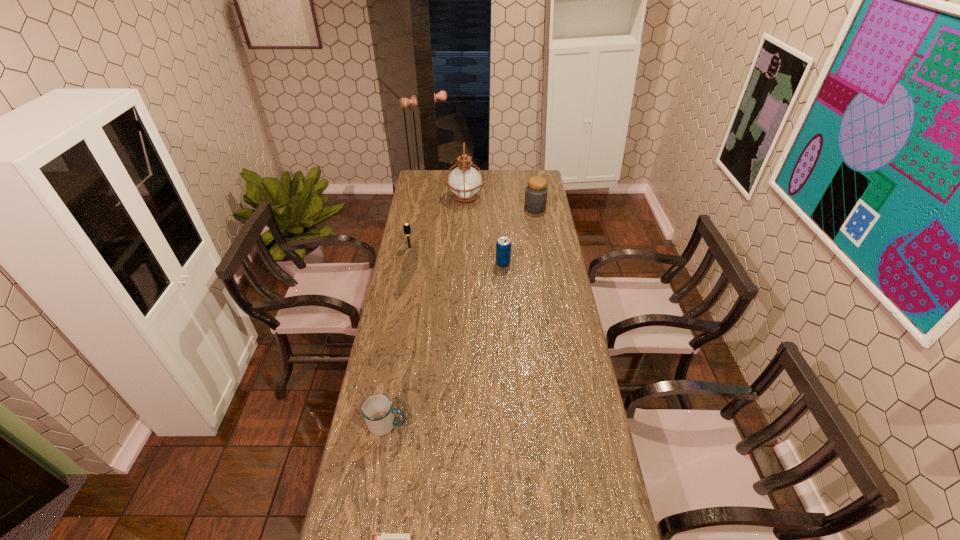
Locate an element on the screen. This screenshot has width=960, height=540. object that stands as the third closest to the third farthest object is located at coordinates (536, 192).

Locate which object is the fifth closest to the fourth nearest object. Please provide its 2D coordinates. Your answer should be formatted as a tuple, i.e. [(x, y)], where the tuple contains the x and y coordinates of a point satisfying the conditions above.

[(376, 539)]

At what (x,y) coordinates should I click in order to perform the action: click on free space that satisfies the following two spatial constraints: 1. on the front side of the pop soda; 2. on the right side of the third farthest object. Please return your answer as a coordinate pair (x, y). This screenshot has width=960, height=540. Looking at the image, I should click on (406, 264).

Identify the location of free space that satisfies the following two spatial constraints: 1. on the front side of the oil lamp; 2. on the right side of the second object from right to left. The width and height of the screenshot is (960, 540). (462, 264).